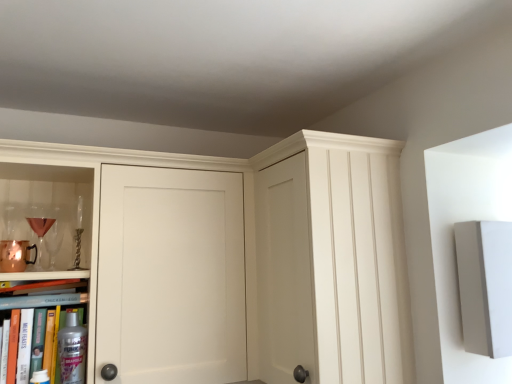
How much space does matte gold wine glass at left, acting as the first wine glass starting from the front, occupy vertically?

The height of matte gold wine glass at left, acting as the first wine glass starting from the front, is 18.15 centimeters.

What do you see at coordinates (41, 240) in the screenshot? Image resolution: width=512 pixels, height=384 pixels. I see `matte gold wine glass at left, arranged as the second wine glass when viewed from the back` at bounding box center [41, 240].

Describe the element at coordinates (50, 309) in the screenshot. The image size is (512, 384). I see `metallic silver spray can at lower left, acting as the first book starting from the bottom` at that location.

How much space does metallic silver spray can at lower left, acting as the first book starting from the bottom, occupy horizontally?

It is 1.86 inches.

What do you see at coordinates (331, 260) in the screenshot? Image resolution: width=512 pixels, height=384 pixels. I see `transparent glass cabinet at center` at bounding box center [331, 260].

Find the location of `satin silver spray at lower left`. satin silver spray at lower left is located at coordinates (72, 350).

From the picture: Does matte gold wine glass at left, arranged as the second wine glass when viewed from the back, have a smaller size compared to hardcover book at lower left, placed as the second book when sorted from bottom to top?

Correct, matte gold wine glass at left, arranged as the second wine glass when viewed from the back, occupies less space than hardcover book at lower left, placed as the second book when sorted from bottom to top.

From a real-world perspective, is matte gold wine glass at left, acting as the first wine glass starting from the front, positioned above or below hardcover book at lower left, placed as the second book when sorted from bottom to top?

In terms of real-world spatial position, matte gold wine glass at left, acting as the first wine glass starting from the front, is above hardcover book at lower left, placed as the second book when sorted from bottom to top.

How distant is matte gold wine glass at left, acting as the first wine glass starting from the front, from hardcover book at lower left, the first book from the top?

matte gold wine glass at left, acting as the first wine glass starting from the front, and hardcover book at lower left, the first book from the top, are 8.65 inches apart.

From the image's perspective, between matte gold wine glass at left, arranged as the second wine glass when viewed from the back, and hardcover book at lower left, placed as the second book when sorted from bottom to top, who is located below?

hardcover book at lower left, placed as the second book when sorted from bottom to top, appears lower in the image.

Measure the distance from hardcover book at lower left, the first book from the top, to matte gold wine glass at left, acting as the first wine glass starting from the front.

hardcover book at lower left, the first book from the top, is 8.65 inches from matte gold wine glass at left, acting as the first wine glass starting from the front.

Can you confirm if hardcover book at lower left, the first book from the top, is positioned to the right of matte gold wine glass at left, acting as the first wine glass starting from the front?

Yes, hardcover book at lower left, the first book from the top, is to the right of matte gold wine glass at left, acting as the first wine glass starting from the front.

From a real-world perspective, is hardcover book at lower left, the first book from the top, positioned above or below matte gold wine glass at left, acting as the first wine glass starting from the front?

hardcover book at lower left, the first book from the top, is below matte gold wine glass at left, acting as the first wine glass starting from the front.

From a real-world perspective, is hardcover book at lower left, the first book from the top, over satin silver spray at lower left?

Yes, from a real-world perspective, hardcover book at lower left, the first book from the top, is above satin silver spray at lower left.

From the image's perspective, which is above, hardcover book at lower left, the first book from the top, or satin silver spray at lower left?

hardcover book at lower left, the first book from the top, appears higher in the image.

Is hardcover book at lower left, placed as the second book when sorted from bottom to top, inside or outside of satin silver spray at lower left?

hardcover book at lower left, placed as the second book when sorted from bottom to top, cannot be found inside satin silver spray at lower left.

Would you say hardcover book at lower left, placed as the second book when sorted from bottom to top, is to the left or to the right of satin silver spray at lower left in the picture?

hardcover book at lower left, placed as the second book when sorted from bottom to top, is to the left of satin silver spray at lower left.

Which is more to the left, metallic silver spray can at lower left, positioned as the 2th book in top-to-bottom order, or hardcover book at lower left, placed as the second book when sorted from bottom to top?

hardcover book at lower left, placed as the second book when sorted from bottom to top.

Is metallic silver spray can at lower left, positioned as the 2th book in top-to-bottom order, surrounding hardcover book at lower left, the first book from the top?

No.

Considering the relative positions of metallic silver spray can at lower left, positioned as the 2th book in top-to-bottom order, and hardcover book at lower left, placed as the second book when sorted from bottom to top, in the image provided, is metallic silver spray can at lower left, positioned as the 2th book in top-to-bottom order, in front of hardcover book at lower left, placed as the second book when sorted from bottom to top,?

Yes, it is in front of hardcover book at lower left, placed as the second book when sorted from bottom to top.

Is matte gold wine glass at left, arranged as the second wine glass when viewed from the back, at the left side of clear glass wine glass at left, which appears as the 1th wine glass when viewed from the back?

Incorrect, matte gold wine glass at left, arranged as the second wine glass when viewed from the back, is not on the left side of clear glass wine glass at left, which appears as the 1th wine glass when viewed from the back.

Considering the relative sizes of matte gold wine glass at left, arranged as the second wine glass when viewed from the back, and clear glass wine glass at left, which is counted as the 2th wine glass, starting from the front, in the image provided, is matte gold wine glass at left, arranged as the second wine glass when viewed from the back, thinner than clear glass wine glass at left, which is counted as the 2th wine glass, starting from the front,?

Indeed, matte gold wine glass at left, arranged as the second wine glass when viewed from the back, has a lesser width compared to clear glass wine glass at left, which is counted as the 2th wine glass, starting from the front.

From the image's perspective, which one is positioned lower, matte gold wine glass at left, arranged as the second wine glass when viewed from the back, or clear glass wine glass at left, which is counted as the 2th wine glass, starting from the front?

matte gold wine glass at left, arranged as the second wine glass when viewed from the back, from the image's perspective.

Is hardcover book at lower left, the first book from the top, in front of or behind transparent glass cabinet at center in the image?

hardcover book at lower left, the first book from the top, is behind transparent glass cabinet at center.

Which is behind, point (42, 297) or point (366, 198)?

The point (42, 297) is farther from the camera.

Would you say hardcover book at lower left, placed as the second book when sorted from bottom to top, is outside transparent glass cabinet at center?

hardcover book at lower left, placed as the second book when sorted from bottom to top, lies outside transparent glass cabinet at center's area.

From the image's perspective, is hardcover book at lower left, the first book from the top, below transparent glass cabinet at center?

Indeed, from the image's perspective, hardcover book at lower left, the first book from the top, is shown beneath transparent glass cabinet at center.

Consider the image. Who is bigger, transparent glass cabinet at center or matte gold wine glass at left, acting as the first wine glass starting from the front?

transparent glass cabinet at center is bigger.

Considering the positions of objects transparent glass cabinet at center and matte gold wine glass at left, arranged as the second wine glass when viewed from the back, in the image provided, who is more to the right, transparent glass cabinet at center or matte gold wine glass at left, arranged as the second wine glass when viewed from the back,?

From the viewer's perspective, transparent glass cabinet at center appears more on the right side.

Is transparent glass cabinet at center taller than matte gold wine glass at left, arranged as the second wine glass when viewed from the back?

Yes.

Is transparent glass cabinet at center positioned far away from matte gold wine glass at left, acting as the first wine glass starting from the front?

transparent glass cabinet at center is near matte gold wine glass at left, acting as the first wine glass starting from the front, not far away.

Find the location of a particular element. The image size is (512, 384). the 1st book below the matte gold wine glass at left, arranged as the second wine glass when viewed from the back (from a real-world perspective) is located at coordinates (47, 296).

At what (x,y) coordinates should I click in order to perform the action: click on book that is the 1st one when counting forward from the matte gold wine glass at left, arranged as the second wine glass when viewed from the back. Please return your answer as a coordinate pair (x, y). The height and width of the screenshot is (384, 512). Looking at the image, I should click on (47, 296).

Considering their positions, is hardcover book at lower left, placed as the second book when sorted from bottom to top, positioned further to transparent glass cabinet at center than matte gold wine glass at left, acting as the first wine glass starting from the front?

matte gold wine glass at left, acting as the first wine glass starting from the front.

Considering their positions, is clear glass wine glass at left, which appears as the 1th wine glass when viewed from the back, positioned closer to metallic silver spray can at lower left, positioned as the 2th book in top-to-bottom order, than transparent glass cabinet at center?

Among the two, clear glass wine glass at left, which appears as the 1th wine glass when viewed from the back, is located nearer to metallic silver spray can at lower left, positioned as the 2th book in top-to-bottom order.

From the picture: Estimate the real-world distances between objects in this image. Which object is closer to clear glass wine glass at left, which is counted as the 2th wine glass, starting from the front, metallic silver spray can at lower left, acting as the first book starting from the bottom, or satin silver spray at lower left?

metallic silver spray can at lower left, acting as the first book starting from the bottom, is closer to clear glass wine glass at left, which is counted as the 2th wine glass, starting from the front.

Considering their positions, is metallic silver spray can at lower left, positioned as the 2th book in top-to-bottom order, positioned further to hardcover book at lower left, the first book from the top, than clear glass wine glass at left, which is counted as the 2th wine glass, starting from the front?

The object further to hardcover book at lower left, the first book from the top, is clear glass wine glass at left, which is counted as the 2th wine glass, starting from the front.

Considering their positions, is satin silver spray at lower left positioned closer to hardcover book at lower left, placed as the second book when sorted from bottom to top, than transparent glass cabinet at center?

satin silver spray at lower left is positioned closer to the anchor hardcover book at lower left, placed as the second book when sorted from bottom to top.

From the image, which object appears to be nearer to clear glass wine glass at left, which appears as the 1th wine glass when viewed from the back, satin silver spray at lower left or metallic silver spray can at lower left, acting as the first book starting from the bottom?

metallic silver spray can at lower left, acting as the first book starting from the bottom, is closer to clear glass wine glass at left, which appears as the 1th wine glass when viewed from the back.

From the picture: From the image, which object appears to be nearer to hardcover book at lower left, placed as the second book when sorted from bottom to top, matte gold wine glass at left, arranged as the second wine glass when viewed from the back, or clear glass wine glass at left, which is counted as the 2th wine glass, starting from the front?

clear glass wine glass at left, which is counted as the 2th wine glass, starting from the front, lies closer to hardcover book at lower left, placed as the second book when sorted from bottom to top, than the other object.

Looking at the image, which one is located closer to hardcover book at lower left, placed as the second book when sorted from bottom to top, metallic silver spray can at lower left, acting as the first book starting from the bottom, or transparent glass cabinet at center?

Based on the image, metallic silver spray can at lower left, acting as the first book starting from the bottom, appears to be nearer to hardcover book at lower left, placed as the second book when sorted from bottom to top.

Where is `book between clear glass wine glass at left, which appears as the 1th wine glass when viewed from the back, and metallic silver spray can at lower left, positioned as the 2th book in top-to-bottom order, from top to bottom`? This screenshot has height=384, width=512. book between clear glass wine glass at left, which appears as the 1th wine glass when viewed from the back, and metallic silver spray can at lower left, positioned as the 2th book in top-to-bottom order, from top to bottom is located at coordinates (47, 296).

Find the location of a particular element. This screenshot has height=384, width=512. bottle between matte gold wine glass at left, arranged as the second wine glass when viewed from the back, and metallic silver spray can at lower left, positioned as the 2th book in top-to-bottom order, vertically is located at coordinates [x=72, y=350].

This screenshot has height=384, width=512. What are the coordinates of `bottle between hardcover book at lower left, placed as the second book when sorted from bottom to top, and transparent glass cabinet at center` in the screenshot? It's located at click(72, 350).

The height and width of the screenshot is (384, 512). I want to click on wine glass between clear glass wine glass at left, which appears as the 1th wine glass when viewed from the back, and metallic silver spray can at lower left, positioned as the 2th book in top-to-bottom order, vertically, so click(41, 240).